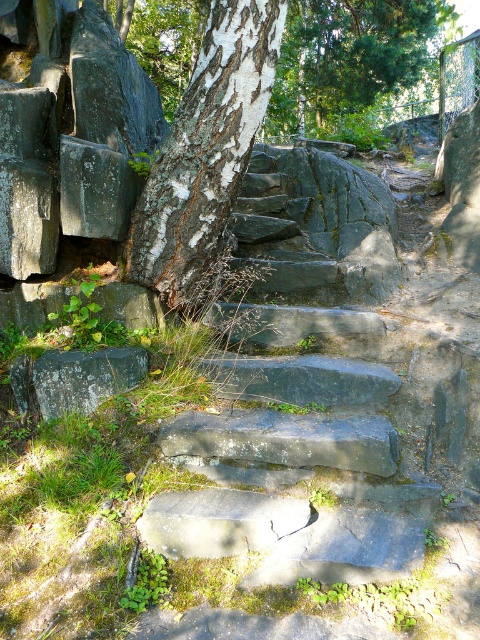
You are a hiker carrying a heavy backpack and need to climb the smooth stone stairs at center. Considering the height of the stairs, will you be able to step onto the green textured tree at upper center from the top step?

The smooth stone stairs at center has a lesser height compared to green textured tree at upper center, so you might struggle to reach the green textured tree at upper center from the top step due to the height difference.

Based on the photo, you are standing at the base of the staircase and want to reach the top. The point representing the smooth stone stairs is at coordinate point (299, 394). Can you determine if this point is located on the staircase?

The smooth stone stairs at center is represented by point (299, 394), so yes, the point is located on the staircase.

You are standing at the bottom of the stone staircase and want to take a photo of the white bark tree at center. Where should you position yourself to ensure the tree is centered in your camera frame?

To center the white bark tree at center in your camera frame, position yourself directly in line with its 2D coordinates at point (x=205, y=147).